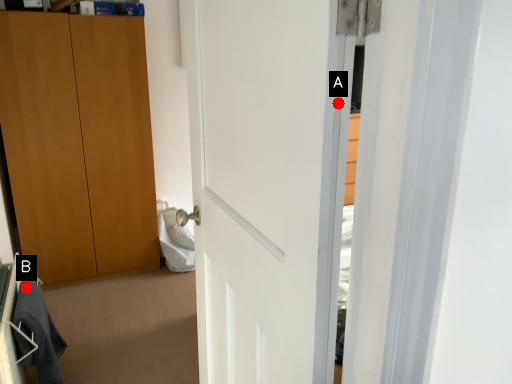
Question: Two points are circled on the image, labeled by A and B beside each circle. Which of the following is the closest to the observer?

Choices:
 (A) A is closer
 (B) B is closer

Answer: (A)